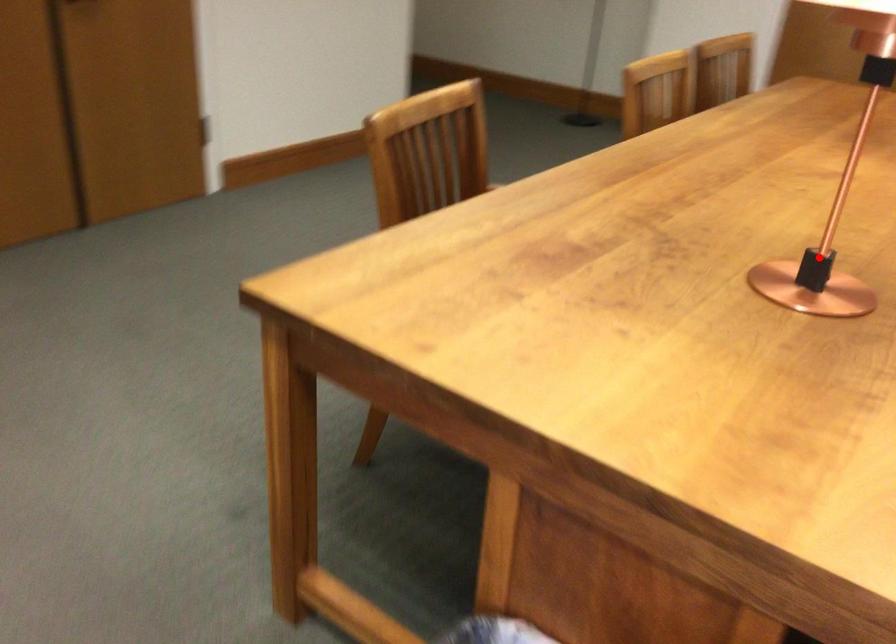
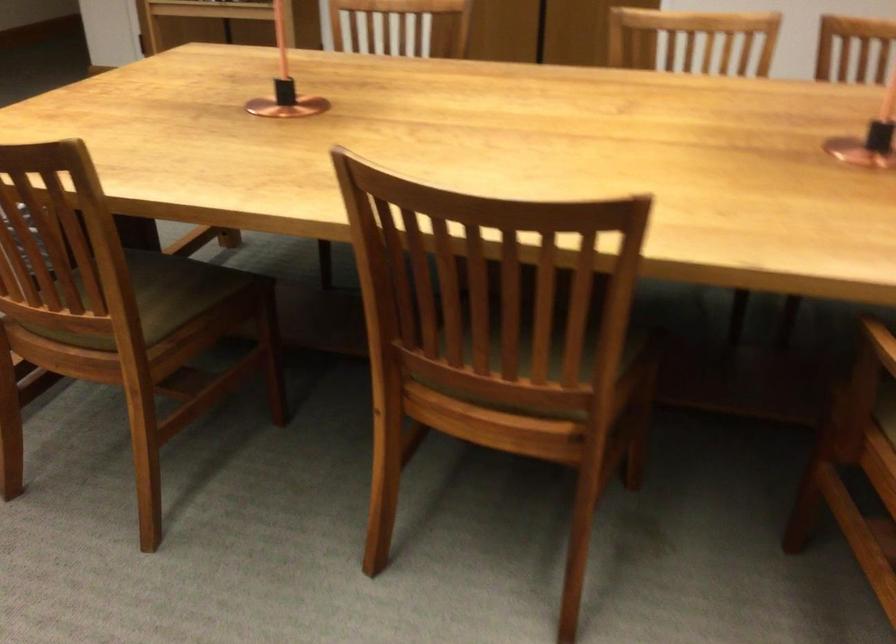
Question: I am providing you with two images of the same scene from different viewpoints. Given a red point in image1, look at the same physical point in image2. Is it:

Choices:
 (A) Closer to the viewpoint
 (B) Farther from the viewpoint

Answer: (B)